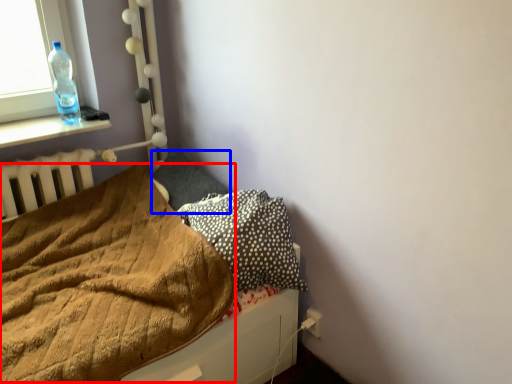
Question: Which object appears closest to the camera in this image, blanket (highlighted by a red box) or pillow (highlighted by a blue box)?

Choices:
 (A) blanket
 (B) pillow

Answer: (A)